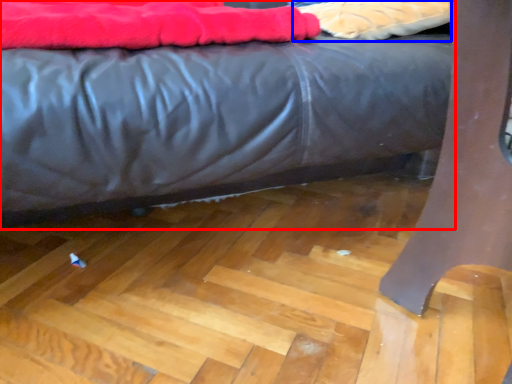
Question: Which of the following is the farthest to the observer, bed (highlighted by a red box) or material (highlighted by a blue box)?

Choices:
 (A) bed
 (B) material

Answer: (B)